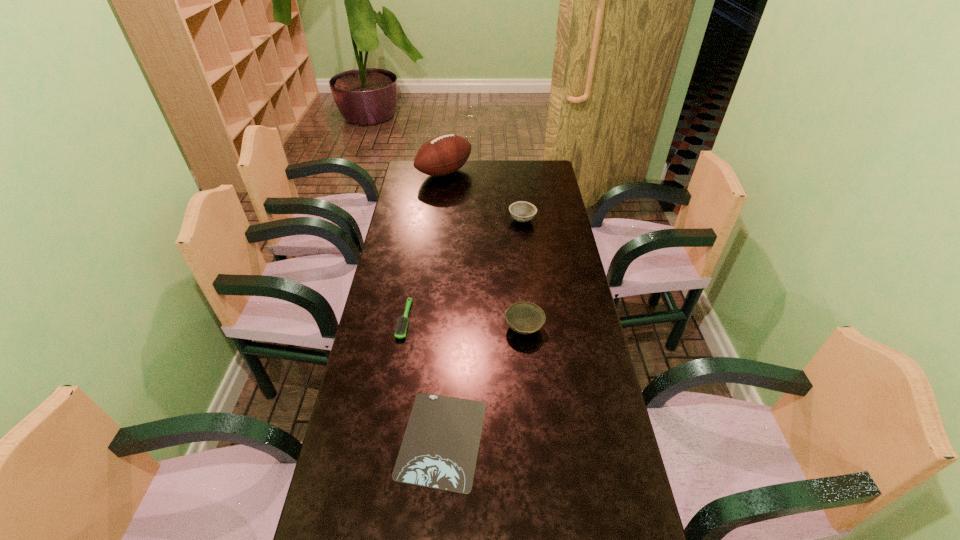
This screenshot has width=960, height=540. Find the location of `free space located 0.200m on the back of the fourth tallest object`. free space located 0.200m on the back of the fourth tallest object is located at coordinates (414, 264).

Locate an element on the screen. free spot located on the back of the shortest object is located at coordinates (450, 315).

Image resolution: width=960 pixels, height=540 pixels. Find the location of `object present at the far edge`. object present at the far edge is located at coordinates (444, 154).

Locate an element on the screen. The image size is (960, 540). football (American) that is at the left edge is located at coordinates (444, 154).

Locate an element on the screen. hairbrush that is positioned at the left edge is located at coordinates (400, 331).

Where is `mousepad positioned at the left edge`? The image size is (960, 540). mousepad positioned at the left edge is located at coordinates (439, 450).

Identify the location of object at the far left corner. This screenshot has height=540, width=960. (444, 154).

Where is `free region at the left edge`? free region at the left edge is located at coordinates (391, 251).

Where is `free space at the right edge`? free space at the right edge is located at coordinates (575, 377).

Locate an element on the screen. Image resolution: width=960 pixels, height=540 pixels. free space at the far left corner of the desktop is located at coordinates (427, 176).